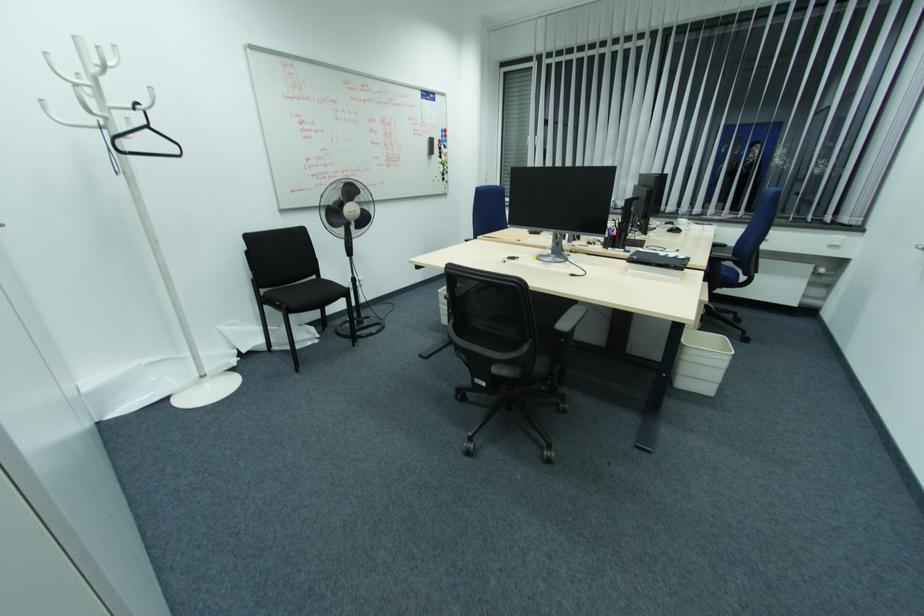
What do you see at coordinates (305, 294) in the screenshot? I see `the black chair sitting surface` at bounding box center [305, 294].